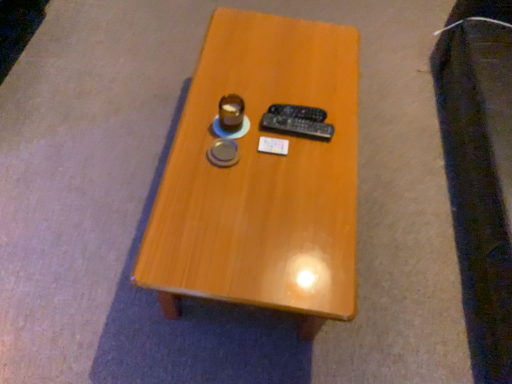
Find the location of a particular element. The image size is (512, 384). free space to the left of matte brown coffee cup at center is located at coordinates (194, 118).